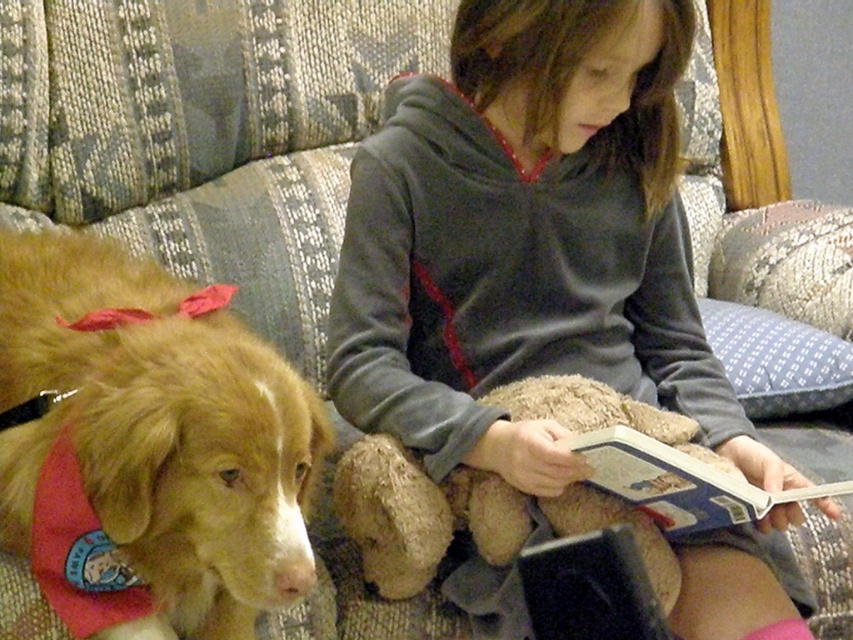
Question: Is gray fleece hoodie at upper center positioned behind hardcover book at center?

Choices:
 (A) no
 (B) yes

Answer: (B)

Question: Which of the following is the closest to the observer?

Choices:
 (A) hardcover book at center
 (B) gray fleece hoodie at upper center
 (C) golden fur dog at left

Answer: (C)

Question: Which object is the closest to the gray fleece hoodie at upper center?

Choices:
 (A) golden fur dog at left
 (B) hardcover book at center

Answer: (B)

Question: Is gray fleece hoodie at upper center bigger than hardcover book at center?

Choices:
 (A) yes
 (B) no

Answer: (A)

Question: Can you confirm if gray fleece hoodie at upper center is wider than hardcover book at center?

Choices:
 (A) no
 (B) yes

Answer: (B)

Question: Estimate the real-world distances between objects in this image. Which object is farther from the golden fur dog at left?

Choices:
 (A) hardcover book at center
 (B) gray fleece hoodie at upper center

Answer: (A)